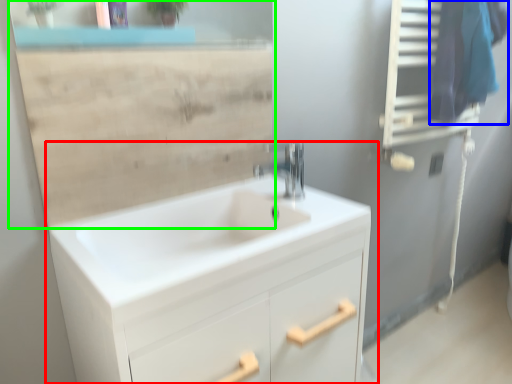
Question: Which is farther away from bathroom cabinet (highlighted by a red box)? laundry (highlighted by a blue box) or mirror (highlighted by a green box)?

Choices:
 (A) laundry
 (B) mirror

Answer: (A)